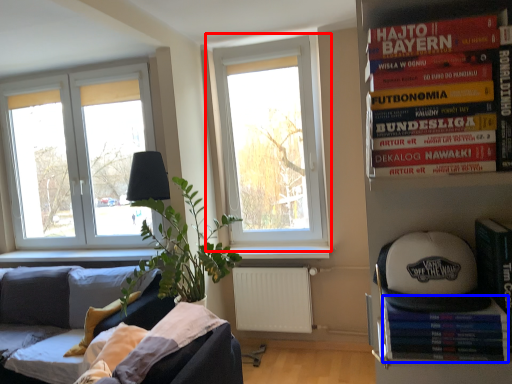
Question: Which object appears closest to the camera in this image, window (highlighted by a red box) or paperback book (highlighted by a blue box)?

Choices:
 (A) window
 (B) paperback book

Answer: (B)